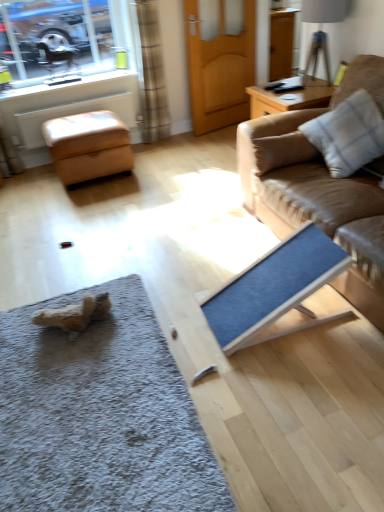
Question: From the image's perspective, is gray shaggy doormat at lower left positioned above or below clear glass window at upper left?

Choices:
 (A) above
 (B) below

Answer: (B)

Question: Looking at their shapes, would you say gray shaggy doormat at lower left is wider or thinner than clear glass window at upper left?

Choices:
 (A) thin
 (B) wide

Answer: (B)

Question: Which of these objects is positioned closest to the leather ottoman at left?

Choices:
 (A) clear glass window at upper left
 (B) white fabric lampshade at upper right
 (C) white checkered fabric pillow on the right
 (D) gray shaggy doormat at lower left
 (E) brown textured curtain at upper left

Answer: (E)

Question: Which is farther from the wooden door at center?

Choices:
 (A) clear glass window at upper left
 (B) leather couch at right
 (C) white fabric lampshade at upper right
 (D) brown textured curtain at upper left
 (E) matte brown armchair at upper left

Answer: (B)